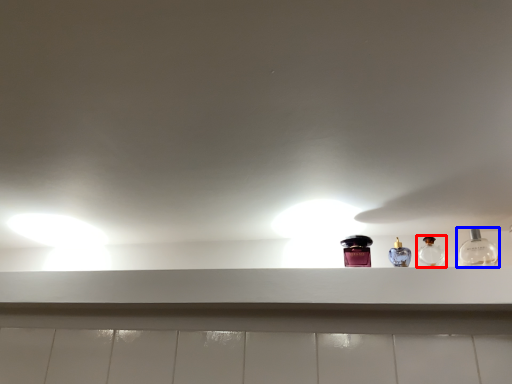
Question: Among these objects, which one is farthest to the camera, bottle (highlighted by a red box) or bottle (highlighted by a blue box)?

Choices:
 (A) bottle
 (B) bottle

Answer: (A)